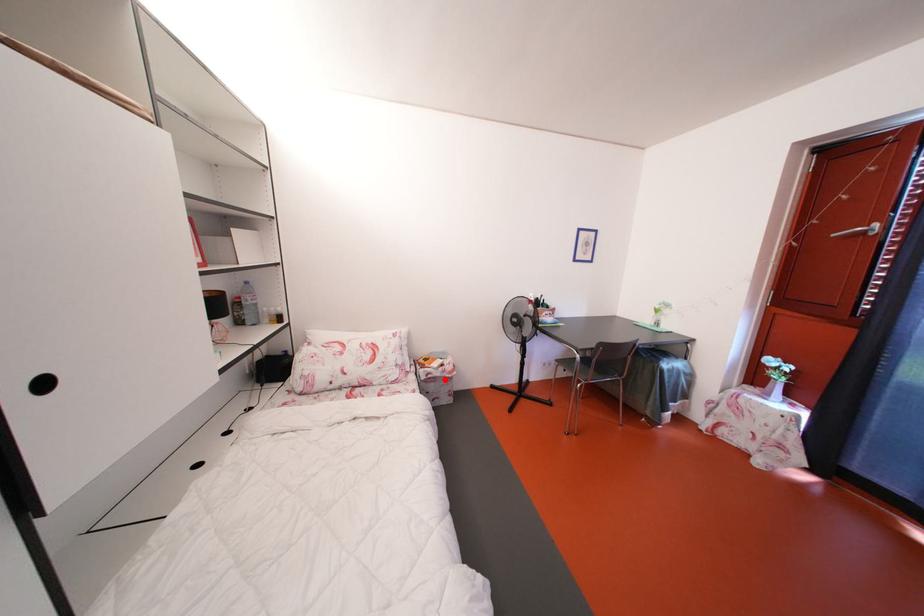
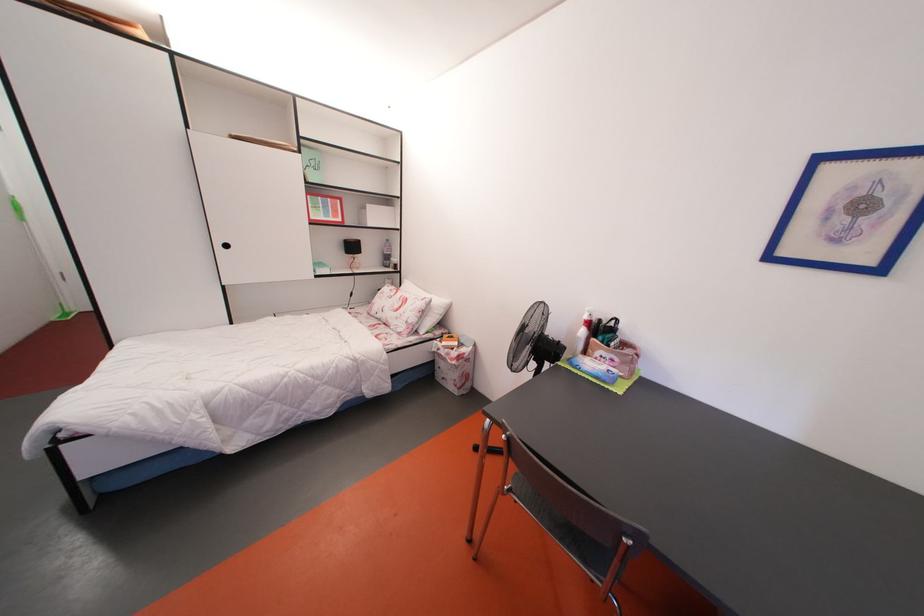
Find the pixel in the second image that matches the highlighted location in the first image.

(450, 360)